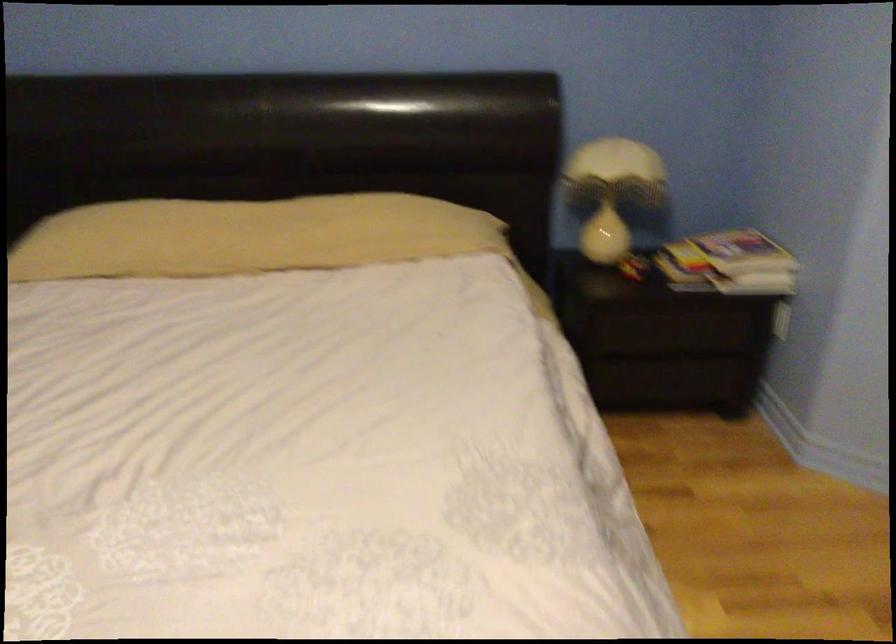
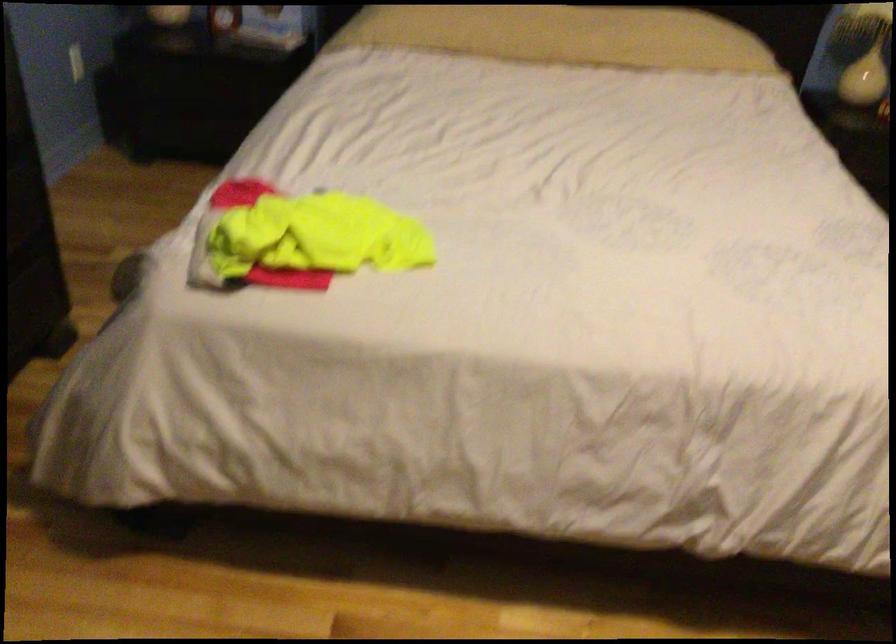
Question: How did the camera likely rotate?

Choices:
 (A) Left
 (B) Right
 (C) Up
 (D) Down

Answer: (D)